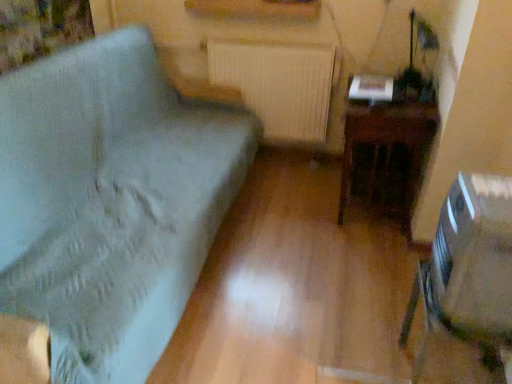
Find the location of `free point above white textured radiator at center (from a real-world perspective)`. free point above white textured radiator at center (from a real-world perspective) is located at coordinates (275, 43).